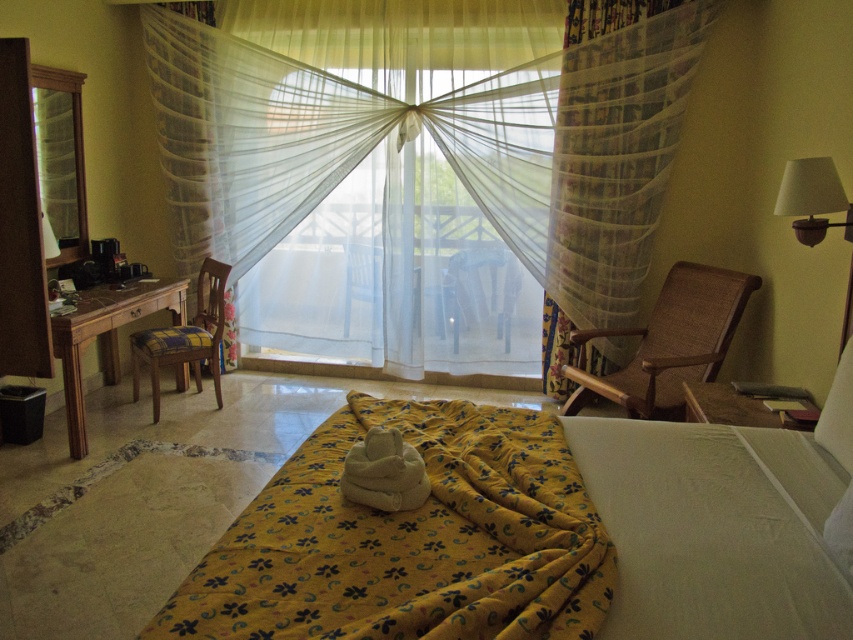
Between sheer white curtain at center and plaid fabric chair at left, which one appears on the left side from the viewer's perspective?

From the viewer's perspective, plaid fabric chair at left appears more on the left side.

This screenshot has width=853, height=640. Find the location of `sheer white curtain at center`. sheer white curtain at center is located at coordinates (421, 168).

Image resolution: width=853 pixels, height=640 pixels. Identify the location of sheer white curtain at center. (421, 168).

Locate an element on the screen. The image size is (853, 640). sheer floral fabric at right is located at coordinates [616, 148].

Who is positioned more to the left, sheer floral fabric at right or brown woven rocking chair at right?

sheer floral fabric at right

Between point (582, 259) and point (694, 337), which one is positioned in front?

Positioned in front is point (694, 337).

At what (x,y) coordinates should I click in order to perform the action: click on sheer floral fabric at right. Please return your answer as a coordinate pair (x, y). The image size is (853, 640). Looking at the image, I should click on (616, 148).

Based on the photo, does yellow floral fabric blanket at center have a greater height compared to plaid fabric chair at left?

No, yellow floral fabric blanket at center is not taller than plaid fabric chair at left.

Looking at this image, can you confirm if yellow floral fabric blanket at center is positioned to the right of plaid fabric chair at left?

Yes, yellow floral fabric blanket at center is to the right of plaid fabric chair at left.

Who is more forward, (521, 465) or (157, 369)?

Point (521, 465) is in front.

Find the location of a particular element. This screenshot has width=853, height=640. yellow floral fabric blanket at center is located at coordinates (x=410, y=540).